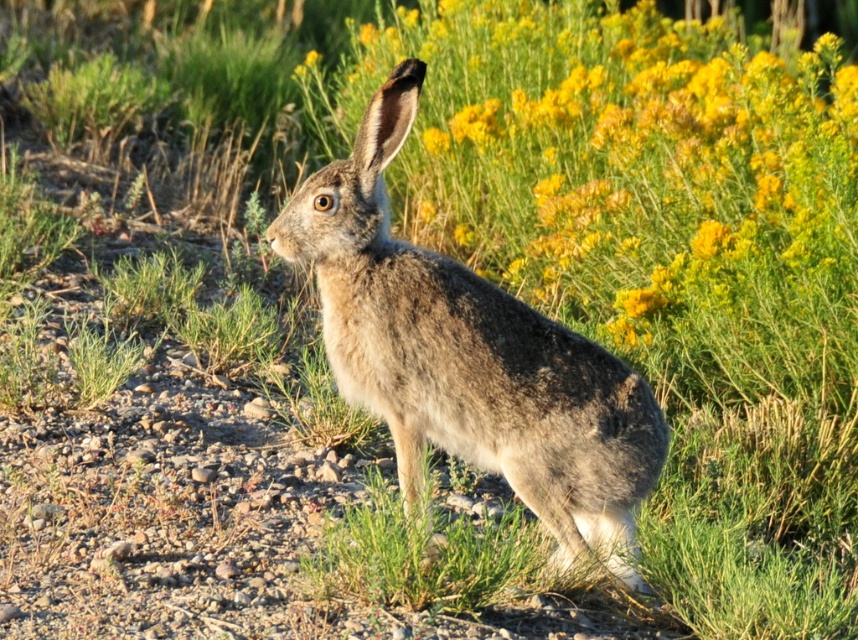
Who is positioned more to the right, yellow-green textured flowers at upper right or fuzzy brown rabbit at center?

Positioned to the right is yellow-green textured flowers at upper right.

What are the coordinates of `yellow-green textured flowers at upper right` in the screenshot? It's located at (631, 180).